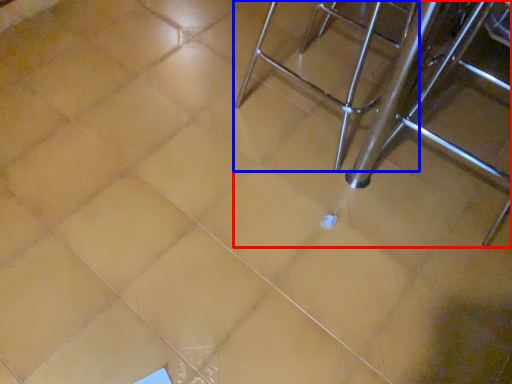
Question: Which object appears closest to the camera in this image, furniture (highlighted by a red box) or chair (highlighted by a blue box)?

Choices:
 (A) furniture
 (B) chair

Answer: (A)